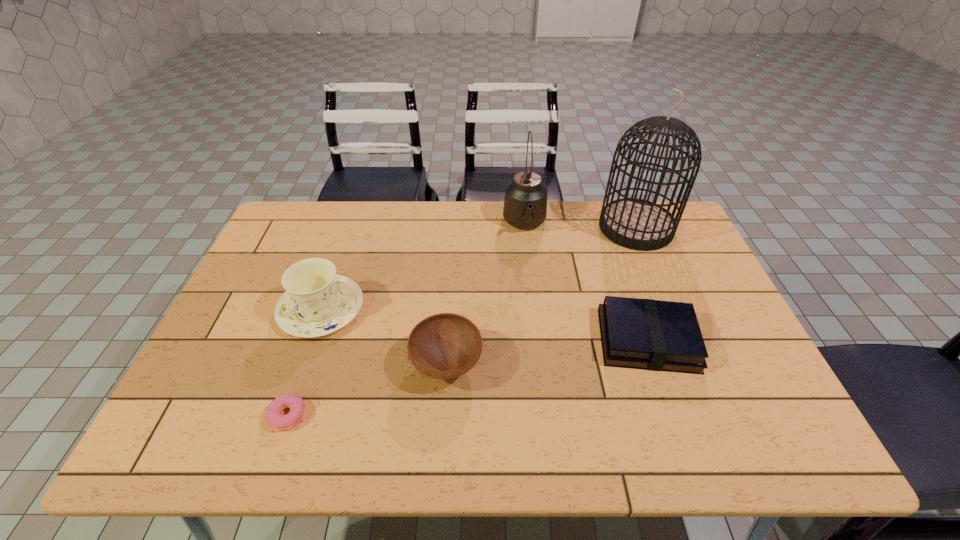
The height and width of the screenshot is (540, 960). What are the coordinates of `empty location between the tallest object and the fourth object from left to right` in the screenshot? It's located at (581, 226).

I want to click on free space between the fifth shortest object and the nearest object, so click(406, 321).

You are a GUI agent. You are given a task and a screenshot of the screen. Output one action in this format:
    pyautogui.click(x=<x>, y=<y>)
    Task: Click on the free space between the bowl and the fourth shortest object
    Image resolution: width=960 pixels, height=540 pixels.
    Given the screenshot: What is the action you would take?
    pyautogui.click(x=384, y=337)

Where is `empty space between the fourth shortest object and the birdcage`? This screenshot has height=540, width=960. empty space between the fourth shortest object and the birdcage is located at coordinates (479, 268).

Where is `unoccupied area between the kettle and the shortest object`? unoccupied area between the kettle and the shortest object is located at coordinates (406, 321).

Image resolution: width=960 pixels, height=540 pixels. What are the coordinates of `empty space that is in between the chinaware and the fifth tallest object` in the screenshot? It's located at (485, 325).

Identify the location of vacant region between the doughnut and the fifth shortest object. This screenshot has height=540, width=960. (406, 321).

The width and height of the screenshot is (960, 540). Identify the location of empty space between the book and the bowl. click(547, 352).

Where is `object that ranks as the fourth closest to the tallest object`? This screenshot has height=540, width=960. object that ranks as the fourth closest to the tallest object is located at coordinates (317, 302).

Locate an element on the screen. object that is the fifth closest to the book is located at coordinates (296, 404).